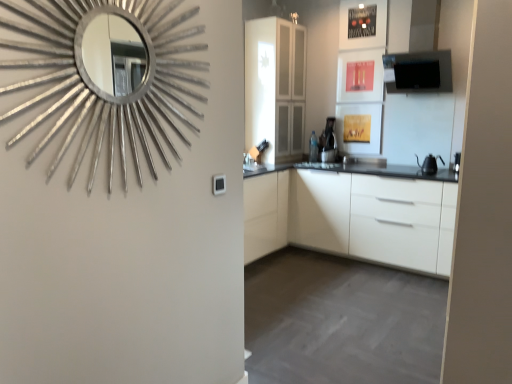
Measure the distance between point (400,87) and camera.

Point (400,87) is 4.00 meters from camera.

What do you see at coordinates (421, 54) in the screenshot?
I see `black matte exhaust hood at upper right` at bounding box center [421, 54].

Locate an element on the screen. black plastic coffee machine at center is located at coordinates (328, 139).

Where is `white glossy sink at center`? This screenshot has height=384, width=512. white glossy sink at center is located at coordinates (255, 160).

This screenshot has width=512, height=384. Describe the element at coordinates (352, 217) in the screenshot. I see `white matte cabinet at center` at that location.

What do you see at coordinates (429, 164) in the screenshot? This screenshot has height=384, width=512. I see `black matte kettle at right` at bounding box center [429, 164].

The image size is (512, 384). Find the location of `silver metallic mirror at upper left`. silver metallic mirror at upper left is located at coordinates (105, 76).

Between black matte exhaust hood at upper right and transparent glass cabinet at center, which one has more height?

transparent glass cabinet at center.

In the image, is black matte exhaust hood at upper right positioned in front of or behind transparent glass cabinet at center?

Clearly, black matte exhaust hood at upper right is in front of transparent glass cabinet at center.

From the image's perspective, is black matte exhaust hood at upper right located above or below transparent glass cabinet at center?

Clearly, from the image's perspective, black matte exhaust hood at upper right is above transparent glass cabinet at center.

Does black matte exhaust hood at upper right have a lesser width compared to transparent glass cabinet at center?

Indeed, black matte exhaust hood at upper right has a lesser width compared to transparent glass cabinet at center.

How different are the orientations of silver metallic mirror at upper left and black matte kettle at right in degrees?

The angular difference between silver metallic mirror at upper left and black matte kettle at right is 91 degrees.

Which object is positioned more to the left, silver metallic mirror at upper left or black matte kettle at right?

silver metallic mirror at upper left is more to the left.

Does silver metallic mirror at upper left have a smaller size compared to black matte kettle at right?

No, silver metallic mirror at upper left is not smaller than black matte kettle at right.

Would you say silver metallic mirror at upper left is a long distance from black matte kettle at right?

That's right, there is a large distance between silver metallic mirror at upper left and black matte kettle at right.

Is white matte cabinet at center inside the boundaries of black matte kettle at right, or outside?

white matte cabinet at center lies outside black matte kettle at right.

Relative to black matte kettle at right, is white matte cabinet at center in front or behind?

In the image, white matte cabinet at center appears in front of black matte kettle at right.

From the image's perspective, is white matte cabinet at center positioned above or below black matte kettle at right?

From the image's perspective, white matte cabinet at center appears below black matte kettle at right.

Is white matte cabinet at center to the right of black matte kettle at right from the viewer's perspective?

No, white matte cabinet at center is not to the right of black matte kettle at right.

Does transparent glass cabinet at center appear on the left side of black plastic coffee machine at center?

Yes.

Considering the relative sizes of transparent glass cabinet at center and black plastic coffee machine at center in the image provided, is transparent glass cabinet at center wider than black plastic coffee machine at center?

Yes.

Where is `coffee machine that appears below the transparent glass cabinet at center (from the image's perspective)`? Image resolution: width=512 pixels, height=384 pixels. coffee machine that appears below the transparent glass cabinet at center (from the image's perspective) is located at coordinates 328,139.

At what (x,y) coordinates should I click in order to perform the action: click on glass door below the black matte exhaust hood at upper right (from a real-world perspective). Please return your answer as a coordinate pair (x, y). Looking at the image, I should click on (275, 87).

Which is more to the left, transparent glass cabinet at center or black matte exhaust hood at upper right?

Positioned to the left is transparent glass cabinet at center.

Is transparent glass cabinet at center closer to the viewer compared to black matte exhaust hood at upper right?

No, transparent glass cabinet at center is behind black matte exhaust hood at upper right.

Can you confirm if transparent glass cabinet at center is wider than black matte exhaust hood at upper right?

Indeed, transparent glass cabinet at center has a greater width compared to black matte exhaust hood at upper right.

From the image's perspective, is white glossy sink at center above or below black plastic coffee machine at center?

white glossy sink at center is situated lower than black plastic coffee machine at center in the image.

Is point (252, 156) behind point (332, 146)?

No.

How different are the orientations of white glossy sink at center and black plastic coffee machine at center in degrees?

white glossy sink at center and black plastic coffee machine at center are facing 88.7 degrees away from each other.

Between point (327, 125) and point (248, 176), which one is positioned behind?

Point (327, 125)

Is black plastic coffee machine at center aimed at white glossy sink at center?

No, black plastic coffee machine at center is not oriented towards white glossy sink at center.

Does black plastic coffee machine at center appear on the left side of white glossy sink at center?

No, black plastic coffee machine at center is not to the left of white glossy sink at center.

Looking at this image, is black plastic coffee machine at center located outside white glossy sink at center?

Yes, black plastic coffee machine at center is outside of white glossy sink at center.

Where is `glass door on the left of the black matte exhaust hood at upper right`? glass door on the left of the black matte exhaust hood at upper right is located at coordinates (275, 87).

Find the location of `mirror above the black matte kettle at right (from the image's perspective)`. mirror above the black matte kettle at right (from the image's perspective) is located at coordinates (105, 76).

From the image, which object appears to be farther from transparent glass cabinet at center, black plastic coffee machine at center or black matte exhaust hood at upper right?

black matte exhaust hood at upper right is further to transparent glass cabinet at center.

Looking at the image, which one is located closer to black matte exhaust hood at upper right, white matte cabinet at center or transparent glass cabinet at center?

transparent glass cabinet at center.

Based on their spatial positions, is black matte exhaust hood at upper right or white glossy sink at center further from silver metallic mirror at upper left?

black matte exhaust hood at upper right is positioned further to the anchor silver metallic mirror at upper left.

Considering their positions, is black matte exhaust hood at upper right positioned closer to white glossy sink at center than white matte cabinet at center?

white matte cabinet at center is positioned closer to the anchor white glossy sink at center.

In the scene shown: Estimate the real-world distances between objects in this image. Which object is closer to black matte exhaust hood at upper right, silver metallic mirror at upper left or black plastic coffee machine at center?

Based on the image, black plastic coffee machine at center appears to be nearer to black matte exhaust hood at upper right.

Based on their spatial positions, is white glossy sink at center or transparent glass cabinet at center further from black plastic coffee machine at center?

white glossy sink at center is further to black plastic coffee machine at center.

Which object lies nearer to the anchor point silver metallic mirror at upper left, white glossy sink at center or black matte kettle at right?

Among the two, white glossy sink at center is located nearer to silver metallic mirror at upper left.

Estimate the real-world distances between objects in this image. Which object is closer to white glossy sink at center, silver metallic mirror at upper left or transparent glass cabinet at center?

transparent glass cabinet at center.

The width and height of the screenshot is (512, 384). Identify the location of exhaust hood situated between white glossy sink at center and black matte kettle at right from left to right. (421, 54).

I want to click on appliance located between silver metallic mirror at upper left and transparent glass cabinet at center in the depth direction, so click(429, 164).

Where is `exhaust hood between transparent glass cabinet at center and black matte kettle at right from left to right`? This screenshot has height=384, width=512. exhaust hood between transparent glass cabinet at center and black matte kettle at right from left to right is located at coordinates (421, 54).

Find the location of a particular element. The image size is (512, 384). cabinetry between silver metallic mirror at upper left and black plastic coffee machine at center from front to back is located at coordinates (352, 217).